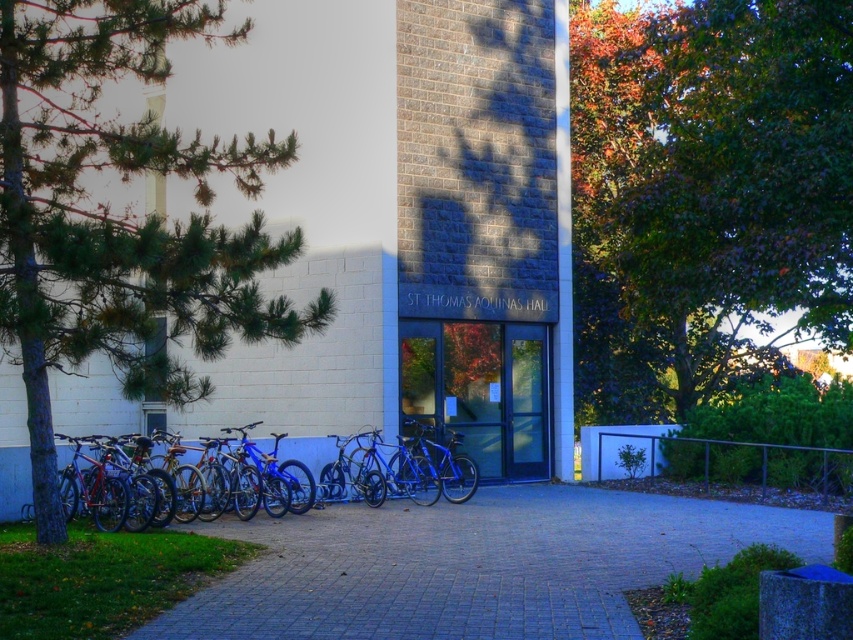
Can you confirm if green needle-like leaves at left is positioned to the left of blue metallic bicycle at center?

Yes, green needle-like leaves at left is to the left of blue metallic bicycle at center.

Can you confirm if green needle-like leaves at left is positioned above blue metallic bicycle at center?

Yes, green needle-like leaves at left is above blue metallic bicycle at center.

You are a GUI agent. You are given a task and a screenshot of the screen. Output one action in this format:
    pyautogui.click(x=<x>, y=<y>)
    Task: Click on the green needle-like leaves at left
    The height and width of the screenshot is (640, 853).
    Given the screenshot: What is the action you would take?
    pyautogui.click(x=120, y=218)

Does green leafy tree at upper right have a larger size compared to blue metallic bicycle at center?

Yes, green leafy tree at upper right is bigger than blue metallic bicycle at center.

Which is more to the right, green leafy tree at upper right or blue metallic bicycle at center?

green leafy tree at upper right

Describe the element at coordinates (705, 193) in the screenshot. The height and width of the screenshot is (640, 853). I see `green leafy tree at upper right` at that location.

Locate an element on the screen. The height and width of the screenshot is (640, 853). green leafy tree at upper right is located at coordinates (705, 193).

Image resolution: width=853 pixels, height=640 pixels. In order to click on green leafy tree at upper right in this screenshot , I will do `click(705, 193)`.

Between green leafy tree at upper right and green needle-like leaves at left, which one has less height?

green needle-like leaves at left

Does point (587, 400) lie in front of point (1, 29)?

No, it is behind (1, 29).

The image size is (853, 640). In order to click on green leafy tree at upper right in this screenshot , I will do `click(705, 193)`.